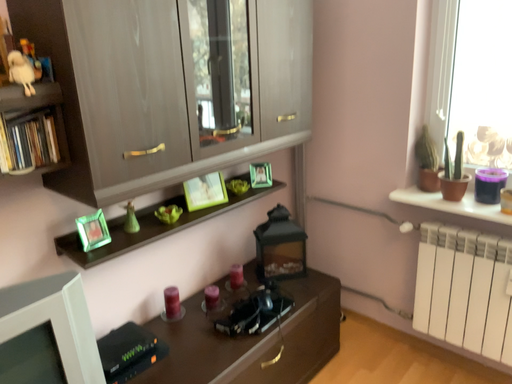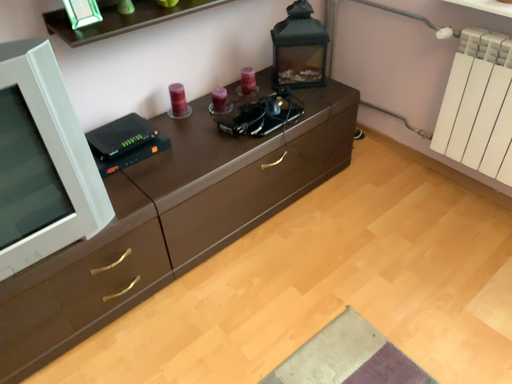
Question: How did the camera likely rotate when shooting the video?

Choices:
 (A) rotated downward
 (B) rotated upward

Answer: (A)